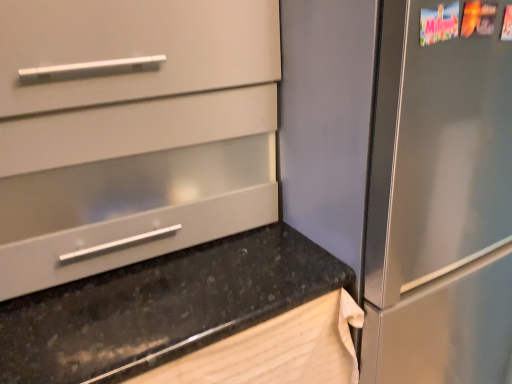
Where is `free space above black granite countertop at lower left (from a real-world perspective)`? Image resolution: width=512 pixels, height=384 pixels. free space above black granite countertop at lower left (from a real-world perspective) is located at coordinates (167, 297).